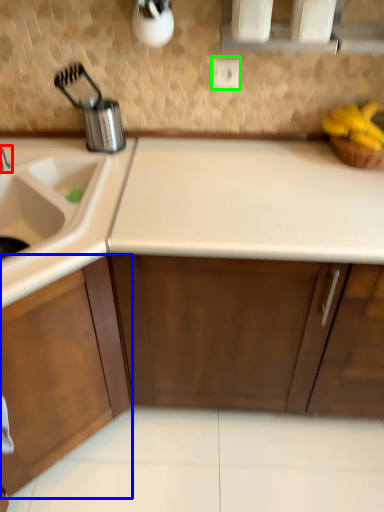
Question: Based on their relative distances, which object is nearer to tap (highlighted by a red box)? Choose from cabinetry (highlighted by a blue box) and electric outlet (highlighted by a green box).

Choices:
 (A) cabinetry
 (B) electric outlet

Answer: (A)